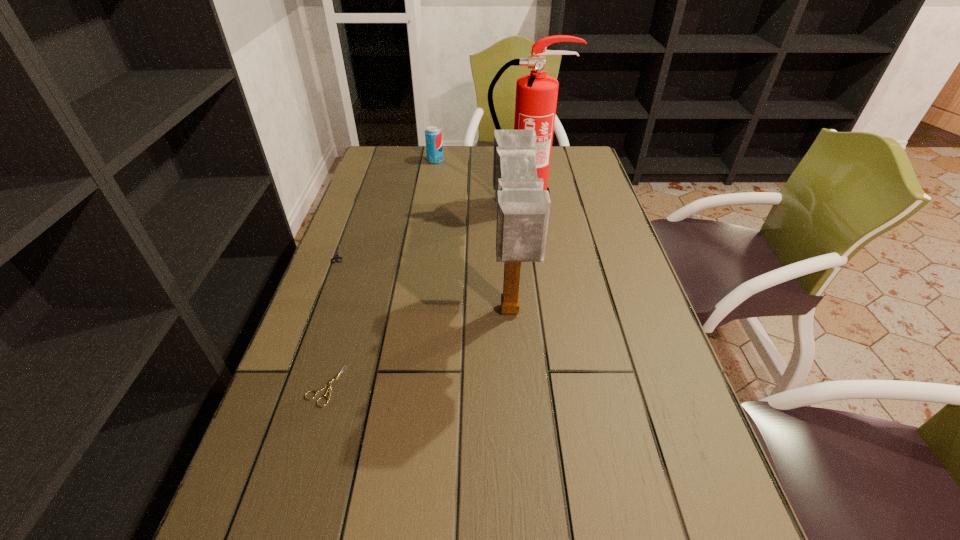
The width and height of the screenshot is (960, 540). I want to click on vacant space situated with the nozzle aimed from the second farthest object, so click(529, 232).

The image size is (960, 540). I want to click on free space located 0.360m on the left of the second nearest object, so click(338, 312).

Locate an element on the screen. vacant space located on the front of the third shortest object is located at coordinates (433, 173).

Where is `vacant region located 0.360m on the front of the farther shears`? The height and width of the screenshot is (540, 960). vacant region located 0.360m on the front of the farther shears is located at coordinates (293, 379).

In order to click on free spot located 0.060m on the front of the nearer shears in this screenshot , I will do `click(310, 437)`.

This screenshot has height=540, width=960. Find the location of `object present at the far edge`. object present at the far edge is located at coordinates (433, 135).

The width and height of the screenshot is (960, 540). What are the coordinates of `object positioned at the right edge` in the screenshot? It's located at (536, 94).

Find the location of a particular element. The width and height of the screenshot is (960, 540). vacant area at the far edge is located at coordinates (466, 150).

At what (x,y) coordinates should I click in order to perform the action: click on vacant space at the left edge of the desktop. Please return your answer as a coordinate pair (x, y). This screenshot has width=960, height=540. Looking at the image, I should click on (359, 244).

In order to click on vacant space at the right edge of the desktop in this screenshot , I will do `click(638, 341)`.